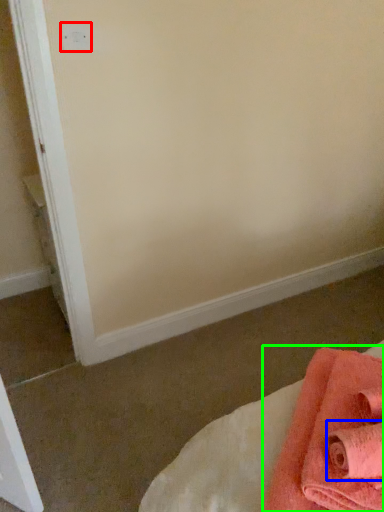
Question: Which object is the farthest from electric outlet (highlighted by a red box)? Choose among these: bath towel (highlighted by a blue box) or towel (highlighted by a green box).

Choices:
 (A) bath towel
 (B) towel

Answer: (A)